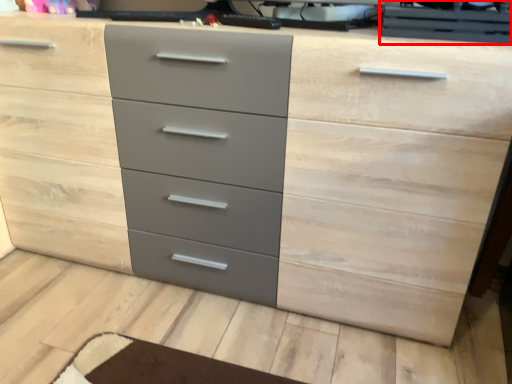
Question: From the image's perspective, considering the relative positions of desktop computer (annotated by the red box) and desktop computer in the image provided, where is desktop computer (annotated by the red box) located with respect to the staircase?

Choices:
 (A) below
 (B) above

Answer: (A)